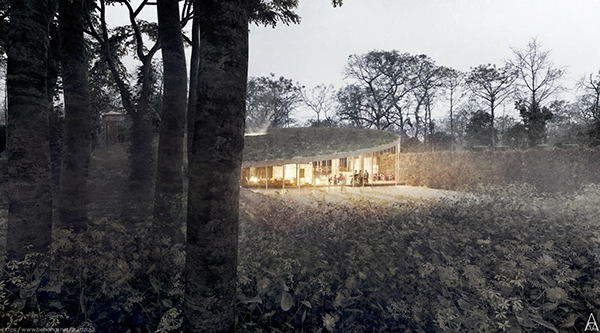
Find the location of a particular element. The image size is (600, 333). door is located at coordinates (304, 175).